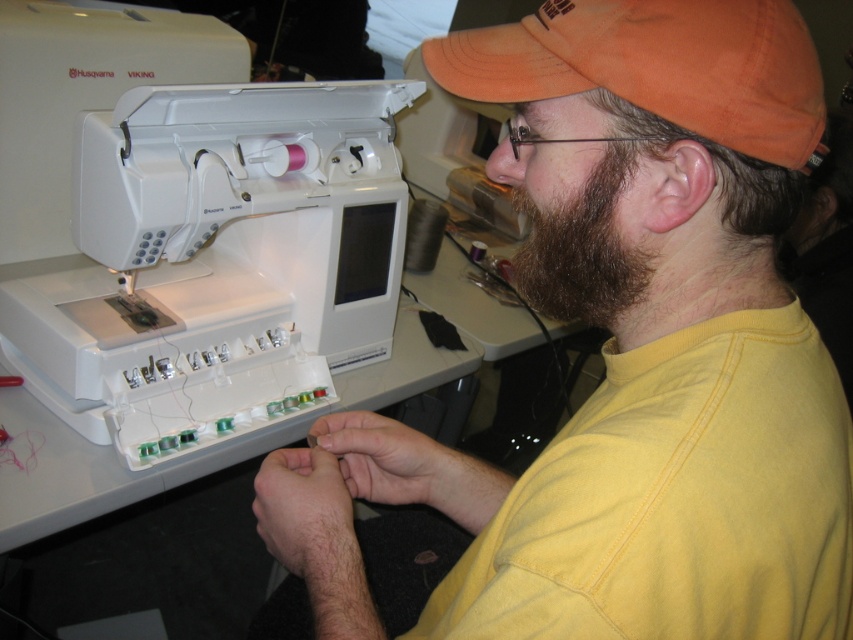
You are a tailor trying to determine which item is wider between the orange fabric cap at upper right and the brown fuzzy beard at right. Which one is wider?

The orange fabric cap at upper right is wider than the brown fuzzy beard at right because its width surpasses the beard.

You are organizing a sewing workshop and need to arrange the yellow cotton shirt at center and the white plastic sewing machine at left on a table. Based on their sizes, which object should you place first to ensure they both fit comfortably on the table?

The yellow cotton shirt at center occupies less space than the white plastic sewing machine at left, so you should place the white plastic sewing machine at left first to accommodate its larger size, then arrange the yellow cotton shirt at center around it.

You are taking a photo of the sewing machine and need to focus on either point (664, 328) or point (393, 300). Which point should you focus on to ensure it appears clearer in the photo?

Point (664, 328) should be focused on because it is closer to the camera and will appear clearer in the photo than point (393, 300) which is farther away.